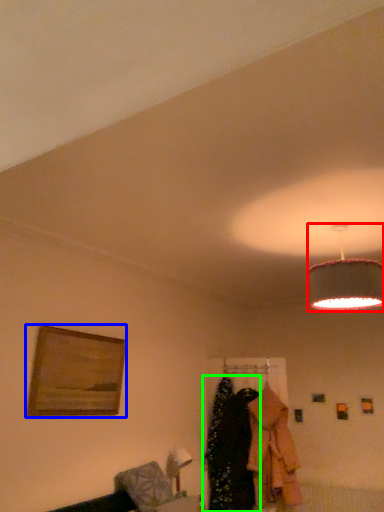
Question: Based on their relative distances, which object is nearer to lamp (highlighted by a red box)? Choose from picture frame (highlighted by a blue box) and clothing (highlighted by a green box).

Choices:
 (A) picture frame
 (B) clothing

Answer: (A)